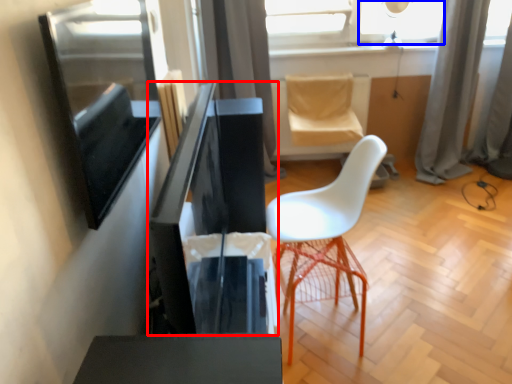
Question: Which object appears farthest to the camera in this image, computer desk (highlighted by a red box) or window (highlighted by a blue box)?

Choices:
 (A) computer desk
 (B) window

Answer: (B)